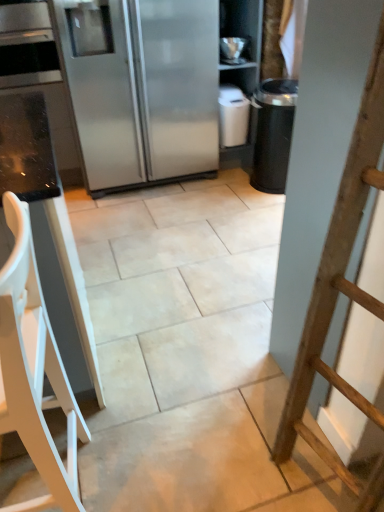
Find the location of `vacant area in front of satin silver refrigerator at upper left`. vacant area in front of satin silver refrigerator at upper left is located at coordinates (168, 215).